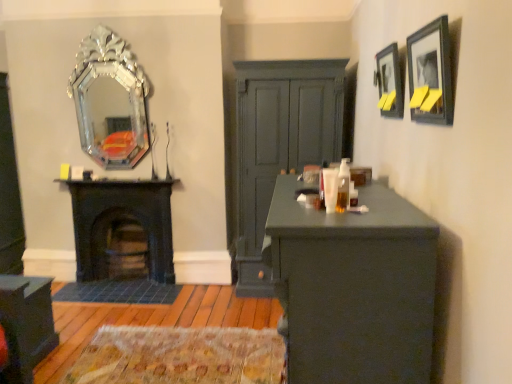
Question: From a real-world perspective, is silver metallic mirror at upper left on matte dark green dresser at center?

Choices:
 (A) no
 (B) yes

Answer: (B)

Question: Considering the relative sizes of silver metallic mirror at upper left and matte dark green dresser at center in the image provided, is silver metallic mirror at upper left taller than matte dark green dresser at center?

Choices:
 (A) yes
 (B) no

Answer: (B)

Question: Is silver metallic mirror at upper left wider than matte dark green dresser at center?

Choices:
 (A) yes
 (B) no

Answer: (B)

Question: Does silver metallic mirror at upper left have a smaller size compared to matte dark green dresser at center?

Choices:
 (A) no
 (B) yes

Answer: (B)

Question: Would you say silver metallic mirror at upper left contains matte dark green dresser at center?

Choices:
 (A) no
 (B) yes

Answer: (A)

Question: Would you say silver metallic mirror at upper left is a long distance from matte dark green dresser at center?

Choices:
 (A) yes
 (B) no

Answer: (A)

Question: From the image's perspective, does matte black cabinet at lower left appear lower than black cast iron fireplace at left?

Choices:
 (A) no
 (B) yes

Answer: (B)

Question: Is black cast iron fireplace at left at the back of matte black cabinet at lower left?

Choices:
 (A) no
 (B) yes

Answer: (A)

Question: Does matte black cabinet at lower left appear on the right side of black cast iron fireplace at left?

Choices:
 (A) yes
 (B) no

Answer: (B)

Question: From a real-world perspective, is matte black cabinet at lower left beneath black cast iron fireplace at left?

Choices:
 (A) yes
 (B) no

Answer: (A)

Question: Does matte black cabinet at lower left have a greater width compared to black cast iron fireplace at left?

Choices:
 (A) yes
 (B) no

Answer: (A)

Question: From the image's perspective, is matte black cabinet at lower left on black cast iron fireplace at left?

Choices:
 (A) no
 (B) yes

Answer: (A)

Question: Is matte black picture frame at upper right, placed as the first picture frame when sorted from back to front, bigger than black cast iron fireplace at left?

Choices:
 (A) yes
 (B) no

Answer: (B)